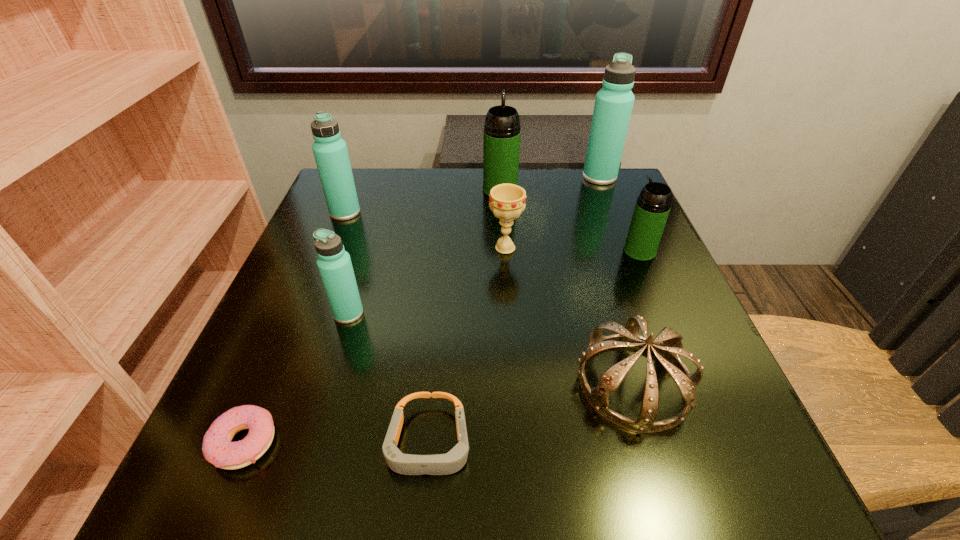
In order to click on unoccupied position between the brown tiara and the second smallest aqua thermos bottle in this screenshot , I will do `click(490, 298)`.

The height and width of the screenshot is (540, 960). What are the coordinates of `vacant point located between the third farthest object and the fourth farthest thermos bottle` in the screenshot? It's located at (492, 232).

Where is `blank region between the goggles and the second nearest thermos bottle`? The image size is (960, 540). blank region between the goggles and the second nearest thermos bottle is located at coordinates (534, 347).

This screenshot has height=540, width=960. Find the location of `empty space between the second smallest aqua thermos bottle and the biggest aqua thermos bottle`. empty space between the second smallest aqua thermos bottle and the biggest aqua thermos bottle is located at coordinates (472, 194).

You are a GUI agent. You are given a task and a screenshot of the screen. Output one action in this format:
    pyautogui.click(x=<x>, y=<y>)
    Task: Click on the free space that is in between the chalice and the brown tiara
    The height and width of the screenshot is (540, 960).
    Given the screenshot: What is the action you would take?
    pyautogui.click(x=569, y=315)

Identify the location of vacant region between the right green thermos bottle and the goggles. (534, 347).

This screenshot has height=540, width=960. Identify the location of free spot between the pink doughnut and the third farthest thermos bottle. (295, 327).

This screenshot has width=960, height=540. Find the location of `the fifth closest object to the doughnut`. the fifth closest object to the doughnut is located at coordinates (330, 151).

Where is `the closest object to the chalice`? Image resolution: width=960 pixels, height=540 pixels. the closest object to the chalice is located at coordinates (501, 144).

Select which thermos bottle appears as the fourth closest to the seventh object from right to left. Please provide its 2D coordinates. Your answer should be formatted as a tuple, i.e. [(x, y)], where the tuple contains the x and y coordinates of a point satisfying the conditions above.

[(613, 106)]